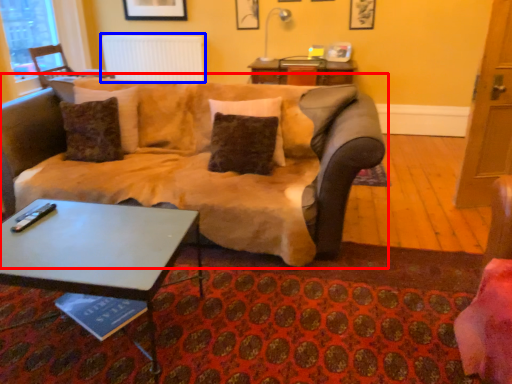
Question: Which object appears closest to the camera in this image, studio couch (highlighted by a red box) or radiator (highlighted by a blue box)?

Choices:
 (A) studio couch
 (B) radiator

Answer: (A)